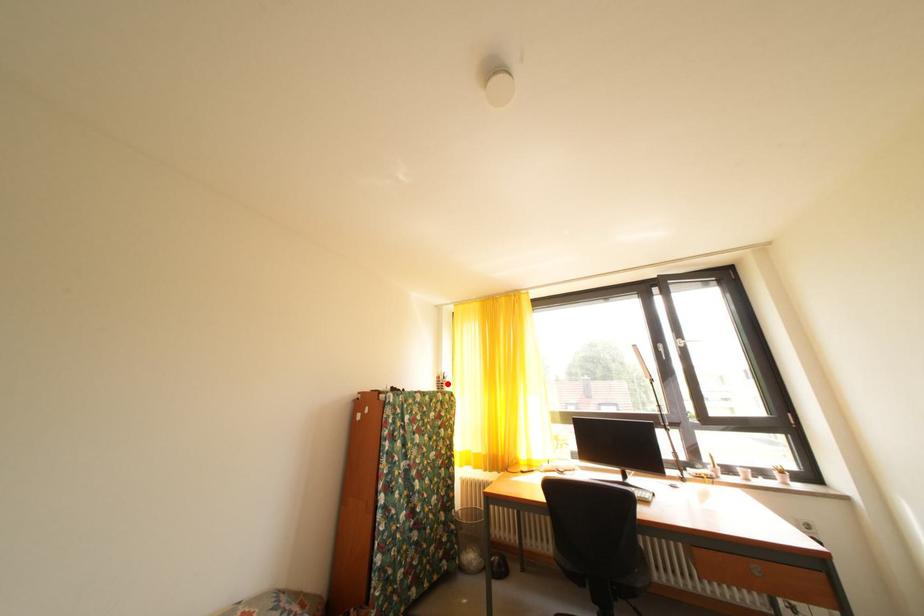
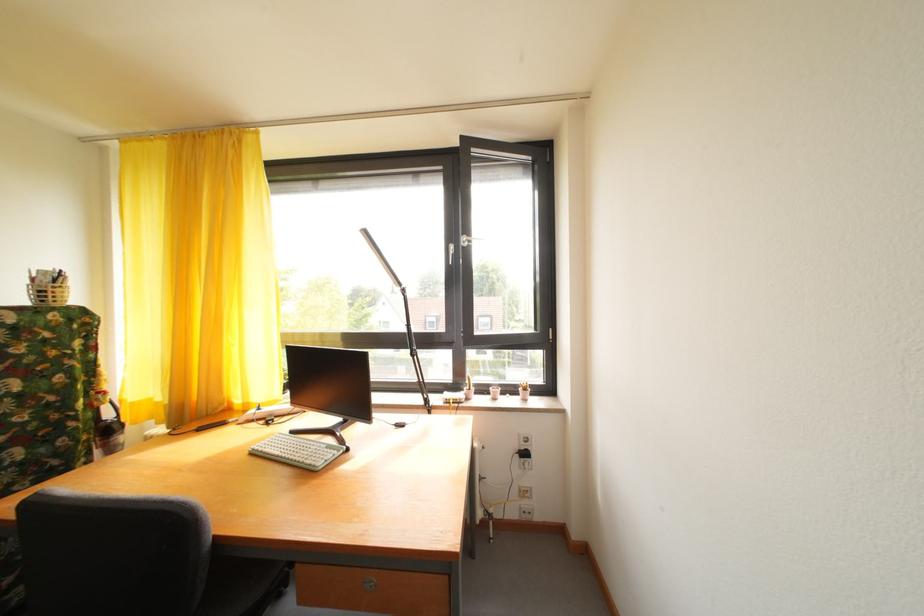
Question: I am providing you with two images of the same scene from different viewpoints. Given a red point in image1, look at the same physical point in image2. Is it:

Choices:
 (A) Closer to the viewpoint
 (B) Farther from the viewpoint

Answer: (A)